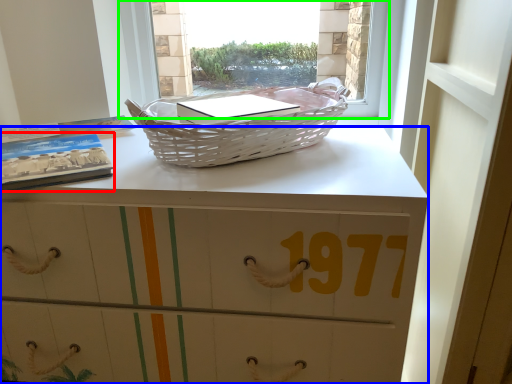
Question: Which object is positioned closest to paperback book (highlighted by a red box)? Select from desk (highlighted by a blue box) and window (highlighted by a green box).

Choices:
 (A) desk
 (B) window

Answer: (A)